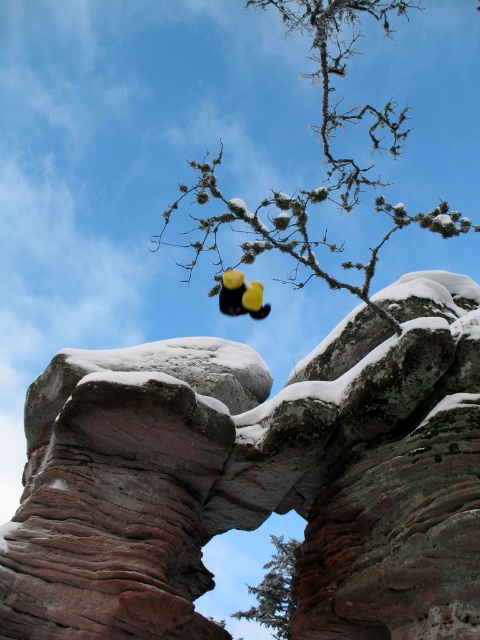
You are a photographer trying to capture the archway and both the green textured tree at center and the yellow matte duck at center in a single shot. Which object should you focus on first to ensure both are in frame?

You should focus on the green textured tree at center first because it is bigger than the yellow matte duck at center, so it will take up more space in the frame and help you position both objects properly.